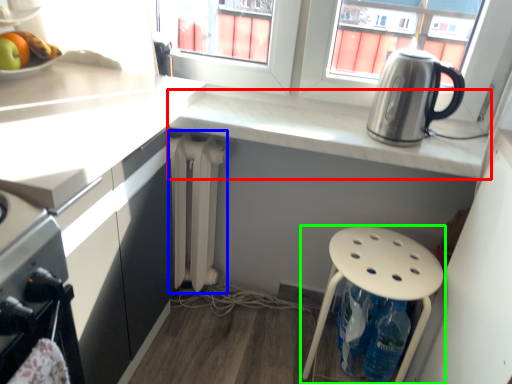
Question: Based on their relative distances, which object is nearer to countertop (highlighted by a red box)? Choose from radiator (highlighted by a blue box) and stool (highlighted by a green box).

Choices:
 (A) radiator
 (B) stool

Answer: (A)